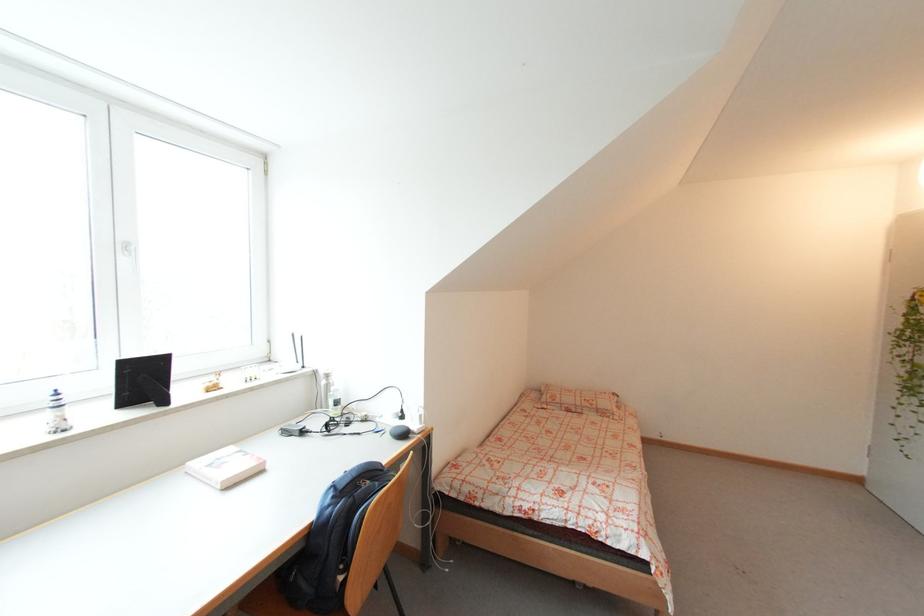
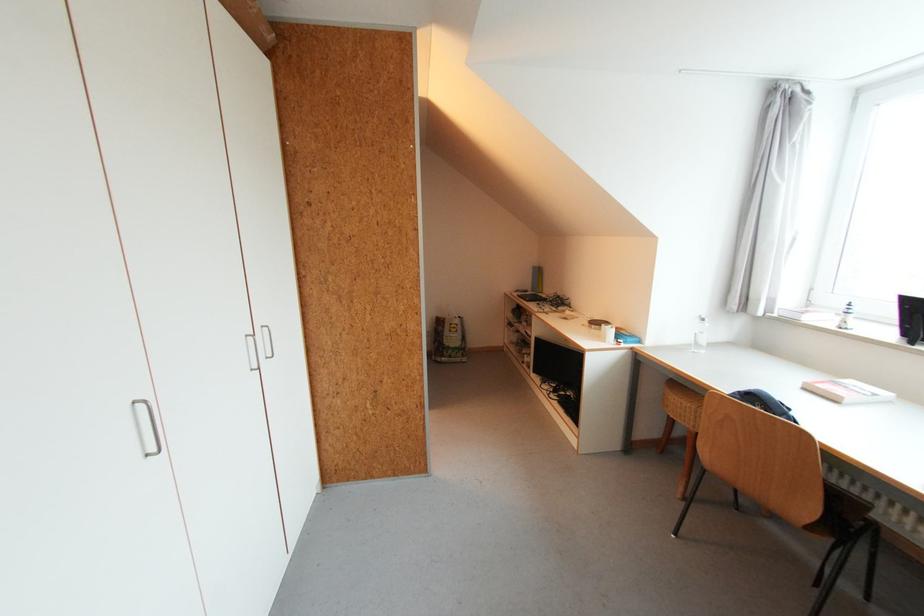
Where in the second image is the point corresponding to (266,472) from the first image?

(841, 403)